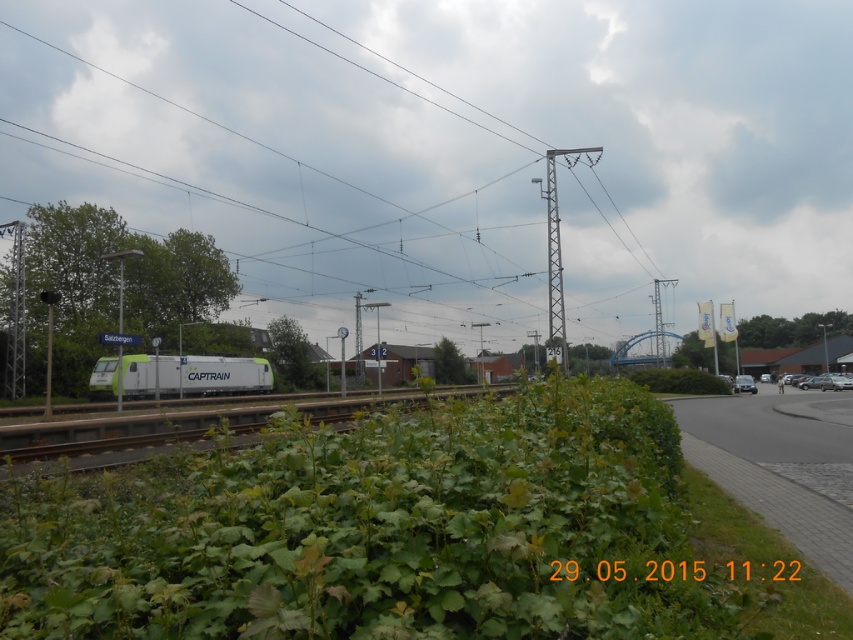
Question: Does green wire at center have a lesser width compared to green matte train at center?

Choices:
 (A) yes
 (B) no

Answer: (B)

Question: Which of the following is the closest to the observer?

Choices:
 (A) (155, 371)
 (B) (683, 88)

Answer: (A)

Question: Is green wire at center above green matte train at center?

Choices:
 (A) no
 (B) yes

Answer: (B)

Question: Is green wire at center below green matte train at center?

Choices:
 (A) yes
 (B) no

Answer: (B)

Question: Which object appears farthest from the camera in this image?

Choices:
 (A) green matte train at center
 (B) green wire at center

Answer: (A)